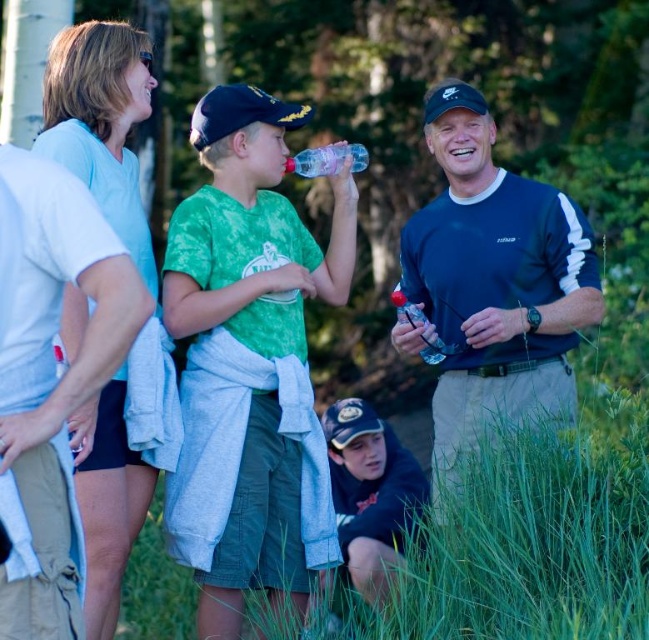
Who is more forward, (x=345, y=154) or (x=397, y=288)?

Point (x=345, y=154) is in front.

Can you confirm if clear plastic bottle at center is thinner than translucent plastic bottle at center?

No, clear plastic bottle at center is not thinner than translucent plastic bottle at center.

Which is behind, point (295, 163) or point (437, 342)?

The point (295, 163) is more distant.

The height and width of the screenshot is (640, 649). I want to click on clear plastic bottle at center, so click(x=326, y=161).

Between green tie-dye t-shirt at center and translucent plastic bottle at center, which one appears on the left side from the viewer's perspective?

green tie-dye t-shirt at center

Is green tie-dye t-shirt at center closer to camera compared to translucent plastic bottle at center?

That is True.

You are a GUI agent. You are given a task and a screenshot of the screen. Output one action in this format:
    pyautogui.click(x=<x>, y=<y>)
    Task: Click on the green tie-dye t-shirt at center
    This screenshot has height=640, width=649.
    Given the screenshot: What is the action you would take?
    (x=249, y=358)

Which is below, dark blue sweatshirt at center or dark blue baseball cap at lower center?

dark blue baseball cap at lower center

Does dark blue sweatshirt at center have a greater width compared to dark blue baseball cap at lower center?

Correct, the width of dark blue sweatshirt at center exceeds that of dark blue baseball cap at lower center.

The height and width of the screenshot is (640, 649). Identify the location of dark blue sweatshirt at center. (493, 284).

Identify the location of dark blue sweatshirt at center. The width and height of the screenshot is (649, 640). (493, 284).